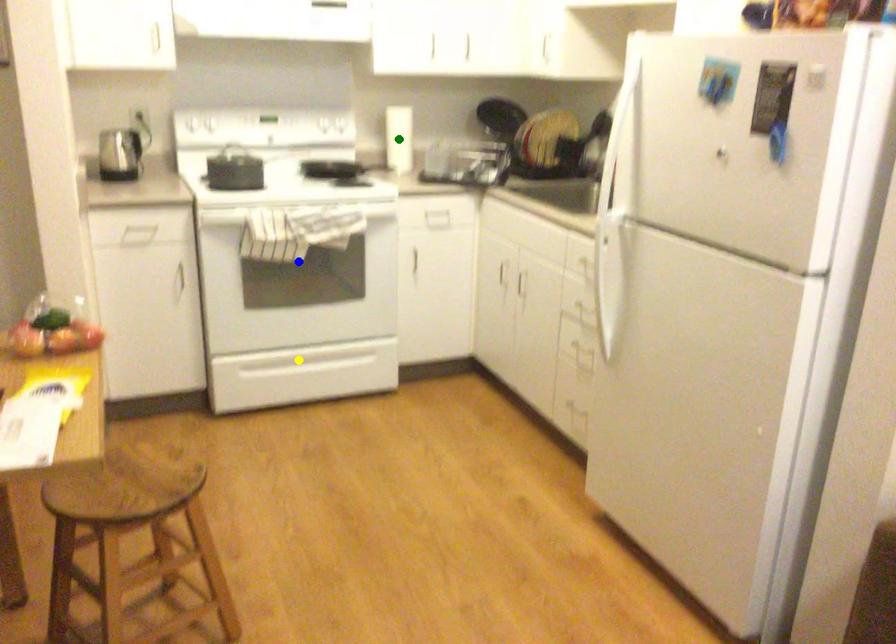
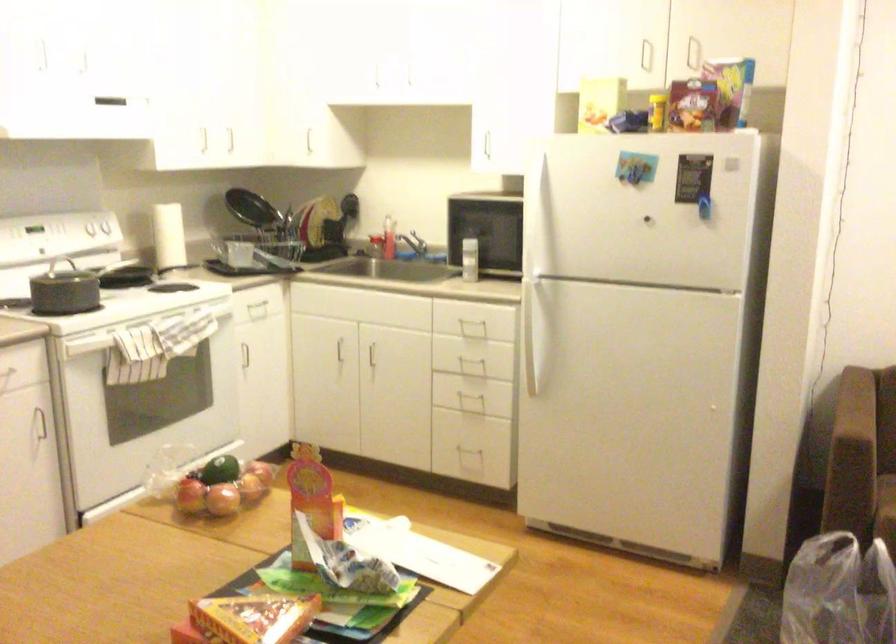
I am providing you with two images of the same scene from different viewpoints. Three points are marked in image1. Which point corresponds to a part or object that is occluded in image2?In image1, three points are marked. Which of them correspond to a part or object that is occluded in image2?Among the three points shown in image1, which one corresponds to a part or object that is no longer visible due to occlusion in image2?

yellow point, green point cannot be seen in image2.